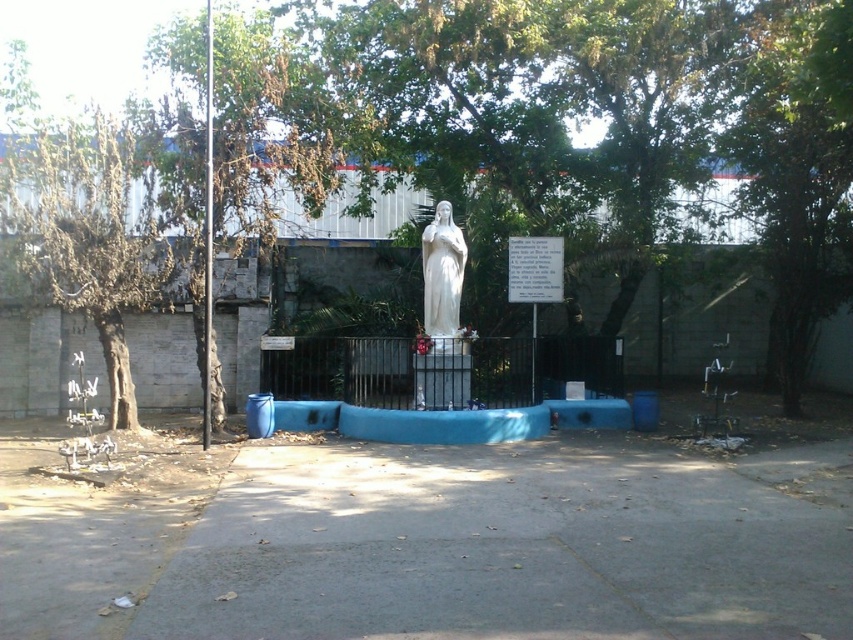
Based on the photo, is gray concrete pavement at center shorter than green leafy tree at center?

Yes, gray concrete pavement at center is shorter than green leafy tree at center.

Which is behind, point (293, 602) or point (807, 292)?

Point (807, 292)

Between point (468, 538) and point (53, 289), which one is positioned in front?

Positioned in front is point (468, 538).

Identify the location of gray concrete pavement at center. (419, 545).

Is green leafy tree at center to the left of white marble statue at center from the viewer's perspective?

Incorrect, green leafy tree at center is not on the left side of white marble statue at center.

The width and height of the screenshot is (853, 640). Identify the location of green leafy tree at center. (793, 216).

This screenshot has width=853, height=640. Find the location of `green leafy tree at center`. green leafy tree at center is located at coordinates (793, 216).

Is point (172, 500) closer to viewer compared to point (436, 308)?

Yes, it is.

Which of these two, gray concrete pavement at center or white marble statue at center, stands shorter?

Standing shorter between the two is gray concrete pavement at center.

Is point (468, 506) behind point (434, 284)?

That is False.

The height and width of the screenshot is (640, 853). I want to click on gray concrete pavement at center, so click(419, 545).